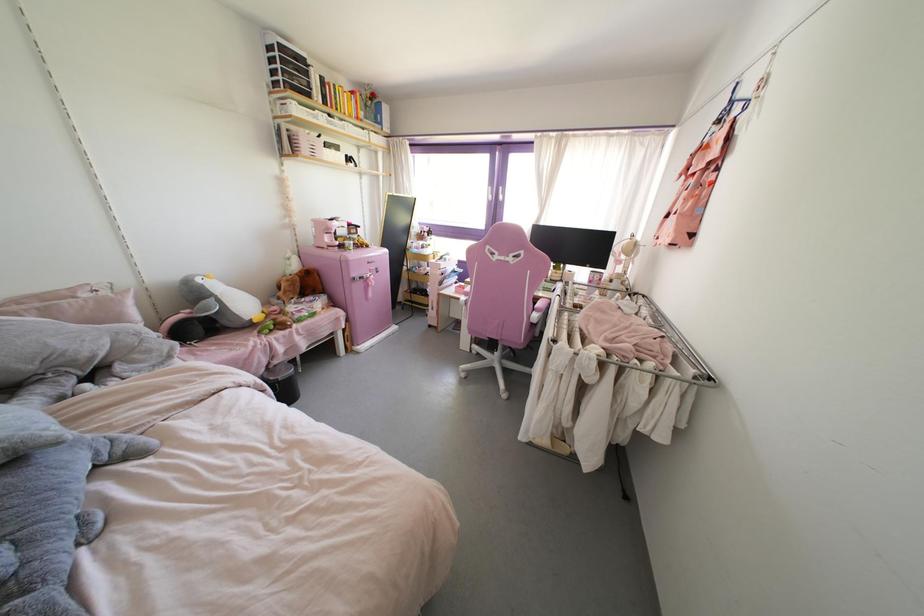
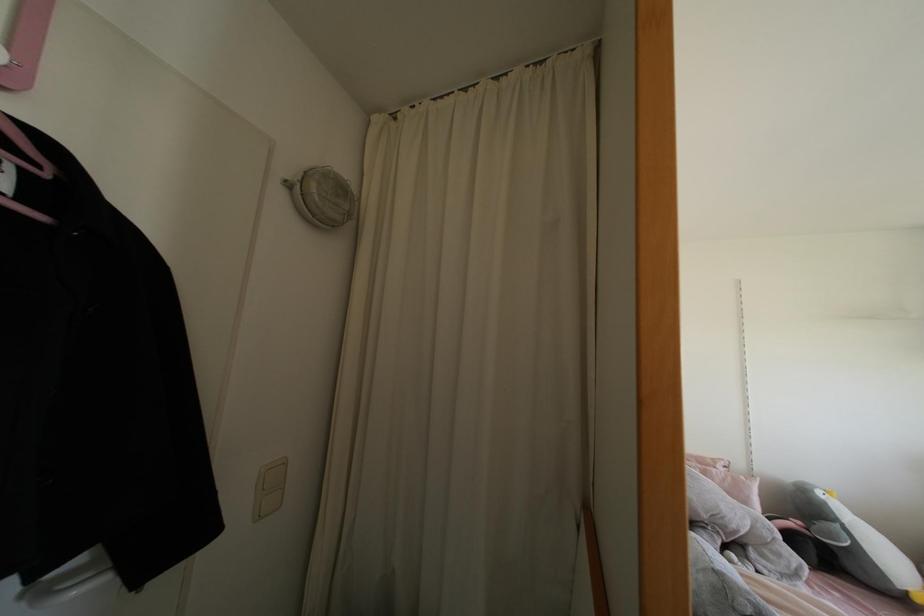
In the second image, find the point that corresponds to [73,289] in the first image.

(712, 460)